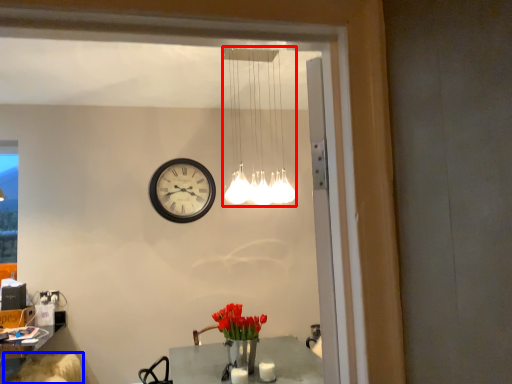
Question: Which object appears farthest to the camera in this image, lamp (highlighted by a red box) or swivel chair (highlighted by a blue box)?

Choices:
 (A) lamp
 (B) swivel chair

Answer: (B)